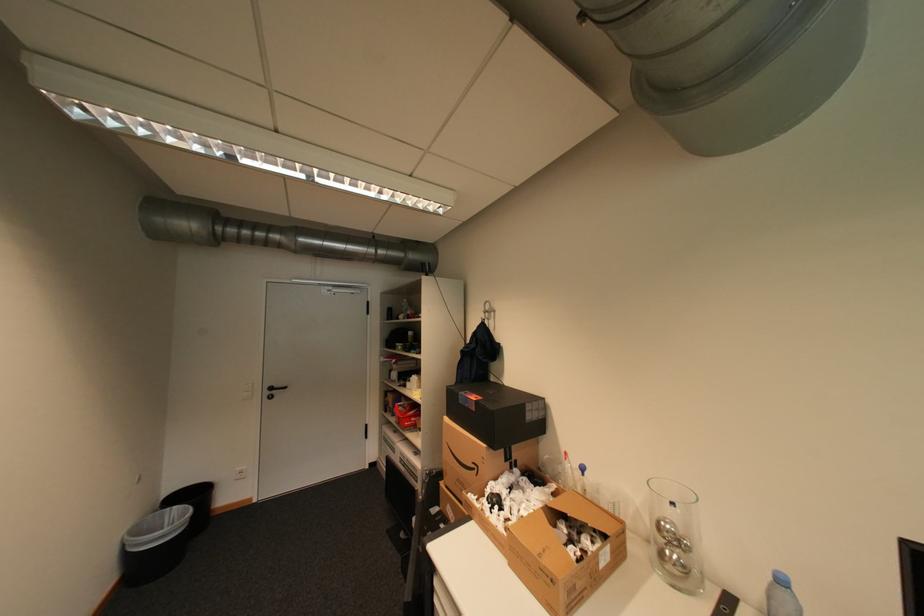
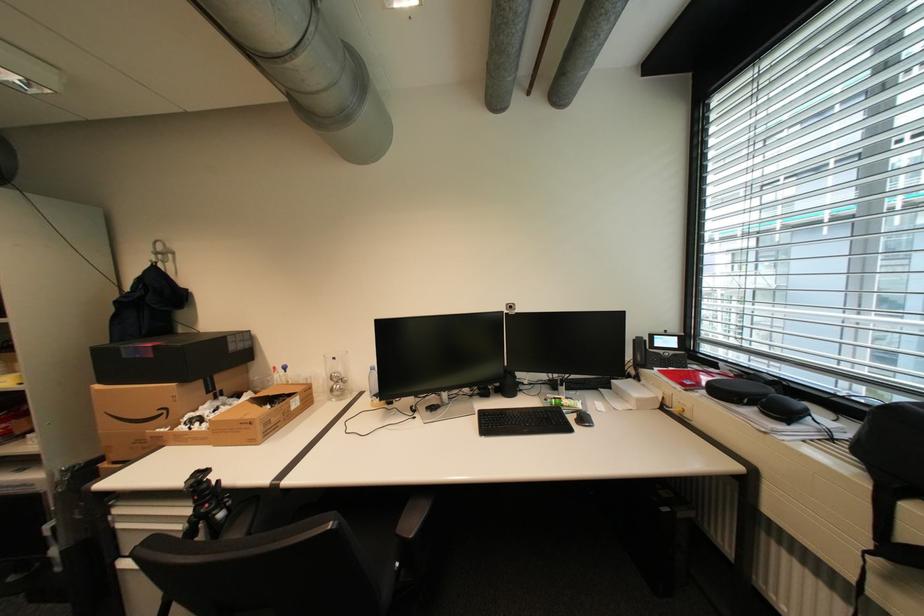
Locate, in the second image, the point that corresponds to (x=493, y=313) in the first image.

(165, 254)